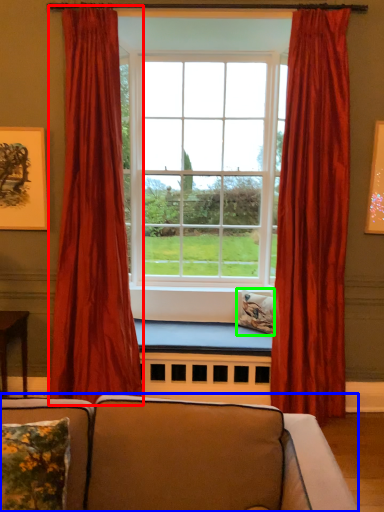
Question: Which object is positioned farthest from curtain (highlighted by a red box)? Select from studio couch (highlighted by a blue box) and pillow (highlighted by a green box).

Choices:
 (A) studio couch
 (B) pillow

Answer: (A)